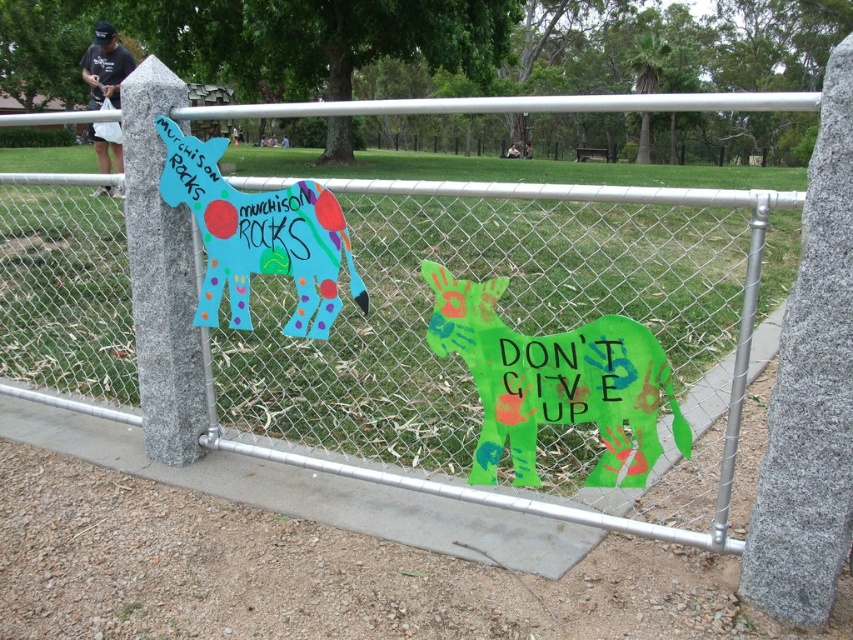
Question: Can you confirm if matte painted donkey at center left is positioned below black cotton shirt at upper left?

Choices:
 (A) no
 (B) yes

Answer: (B)

Question: Does black cotton shirt at upper left come in front of brushed metal water at bottle left?

Choices:
 (A) yes
 (B) no

Answer: (A)

Question: Estimate the real-world distances between objects in this image. Which object is farther from the white fabric bag at upper center?

Choices:
 (A) brushed metal water at bottle left
 (B) granite signpost at left
 (C) matte painted donkey at center left
 (D) black cotton shirt at upper left

Answer: (C)

Question: Considering the real-world distances, which object is closest to the metal chain-link fence at center?

Choices:
 (A) granite signpost at left
 (B) black cotton shirt at upper left
 (C) matte painted donkey at center left

Answer: (C)

Question: Which of the following is the closest to the observer?

Choices:
 (A) (285, 198)
 (B) (119, 61)
 (C) (149, 252)
 (D) (422, 180)

Answer: (A)

Question: Can you confirm if granite signpost at left is thinner than black cotton shirt at upper left?

Choices:
 (A) no
 (B) yes

Answer: (B)